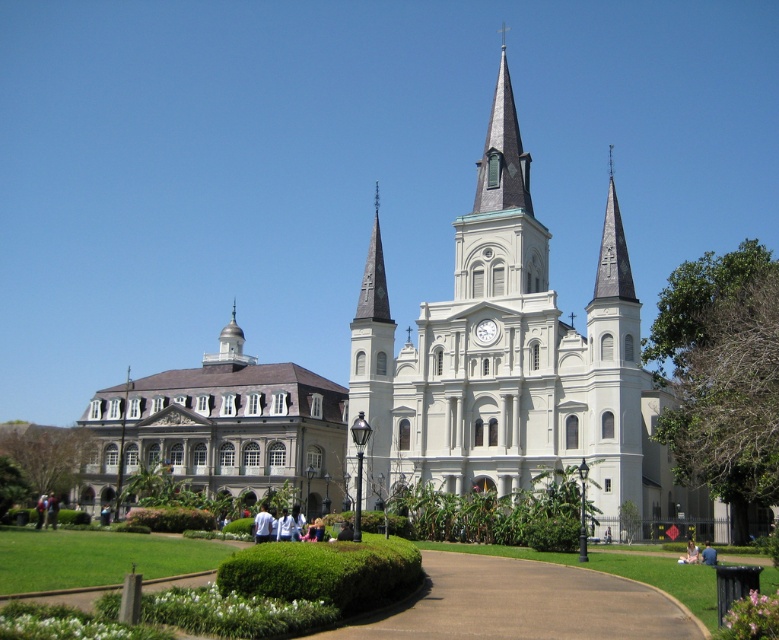
You are standing in front of the church and want to take a photo that includes both the point at coordinates point (315, 500) and point (607, 576). Which point should you focus on first to ensure both are in focus?

You should focus on point (315, 500) first because it is closer to the camera than point (607, 576), ensuring both points are within the depth of field.